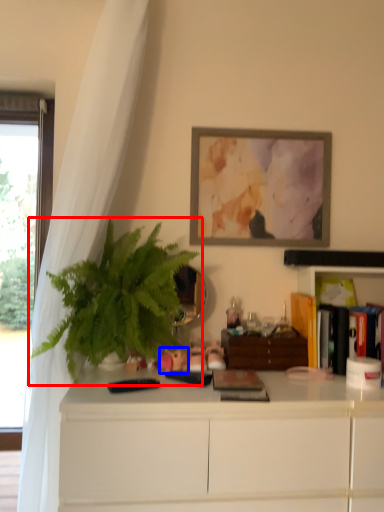
Question: Which of the following is the closest to the observer, houseplant (highlighted by a red box) or toy (highlighted by a blue box)?

Choices:
 (A) houseplant
 (B) toy

Answer: (A)